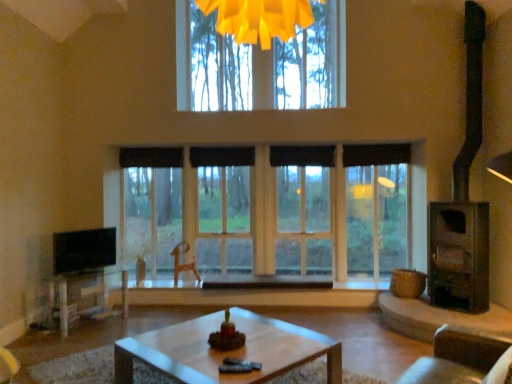
Question: From the image's perspective, would you say black matte curtain at upper center, acting as the fourth curtain starting from the right, is positioned over dark gray metallic fireplace at right?

Choices:
 (A) no
 (B) yes

Answer: (B)

Question: Is black matte curtain at upper center, acting as the fourth curtain starting from the right, oriented towards dark gray metallic fireplace at right?

Choices:
 (A) no
 (B) yes

Answer: (A)

Question: Can you confirm if black matte curtain at upper center, the 1th curtain viewed from the left, is taller than dark gray metallic fireplace at right?

Choices:
 (A) no
 (B) yes

Answer: (A)

Question: Does black matte curtain at upper center, the 1th curtain viewed from the left, come in front of dark gray metallic fireplace at right?

Choices:
 (A) no
 (B) yes

Answer: (A)

Question: Is dark gray metallic fireplace at right completely or partially inside black matte curtain at upper center, acting as the fourth curtain starting from the right?

Choices:
 (A) yes
 (B) no

Answer: (B)

Question: Is wooden coffee table at lower left wider or thinner than clear glass window at center?

Choices:
 (A) thin
 (B) wide

Answer: (B)

Question: Considering the positions of point (94, 292) and point (367, 225), is point (94, 292) closer or farther from the camera than point (367, 225)?

Choices:
 (A) farther
 (B) closer

Answer: (B)

Question: From a real-world perspective, is wooden coffee table at lower left physically located above or below clear glass window at center?

Choices:
 (A) below
 (B) above

Answer: (A)

Question: From the image's perspective, is wooden coffee table at lower left positioned above or below clear glass window at center?

Choices:
 (A) above
 (B) below

Answer: (B)

Question: In terms of width, does black fabric curtain at center, the 2th curtain from the left, look wider or thinner when compared to wooden coffee table at lower left?

Choices:
 (A) wide
 (B) thin

Answer: (B)

Question: Choose the correct answer: Is black fabric curtain at center, acting as the third curtain starting from the right, inside wooden coffee table at lower left or outside it?

Choices:
 (A) inside
 (B) outside

Answer: (B)

Question: Considering the positions of point (203, 165) and point (86, 276), is point (203, 165) closer or farther from the camera than point (86, 276)?

Choices:
 (A) closer
 (B) farther

Answer: (B)

Question: Is black fabric curtain at center, the 2th curtain from the left, in front of or behind wooden coffee table at lower left in the image?

Choices:
 (A) behind
 (B) front

Answer: (A)

Question: Is black glossy tv at left inside the boundaries of black fabric curtain at center, which is the 3th curtain in left-to-right order, or outside?

Choices:
 (A) outside
 (B) inside

Answer: (A)

Question: Considering their positions, is black glossy tv at left located in front of or behind black fabric curtain at center, which is the 3th curtain in left-to-right order?

Choices:
 (A) behind
 (B) front

Answer: (B)